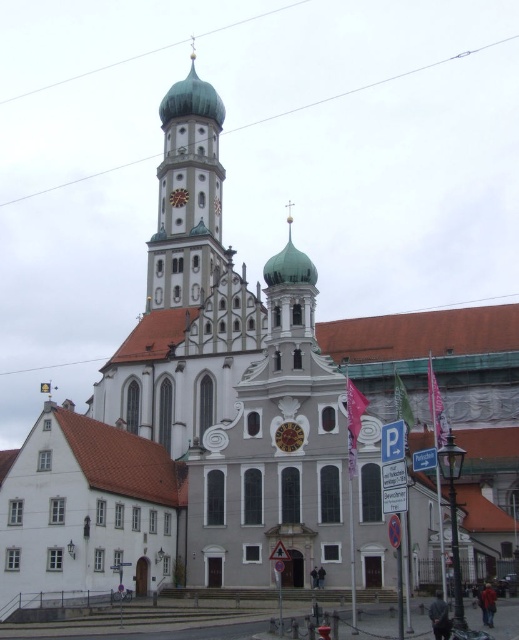
You are standing in front of the historic church and want to take a photo that includes both the point at coordinates point (188,276) and point (281,444). Which point should you focus on first to ensure both are in focus?

You should focus on point (188,276) first because it is closer to the camera than point (281,444). Since it is closer, focusing on it will ensure that the farther point is also within the depth of field.

You are a photographer standing at the entrance of the historic church. You want to capture a photo of the white stone tower at center. Considering your camera can focus on objects up to 100 meters away, will you be able to take a clear photo of the tower?

The white stone tower at center is 88.51 meters away from the camera. Since your camera can focus up to 100 meters, you will be able to take a clear photo of the tower as the distance is within the camera range.

Based on the photo, you are an architect designing a scale model of the church. You need to ensure the white stone tower at center and the gold metallic clock at center are proportionally accurate. Which object should you make larger in your model?

The white stone tower at center should be made larger in the model since it is larger in size than the gold metallic clock at center according to the description.